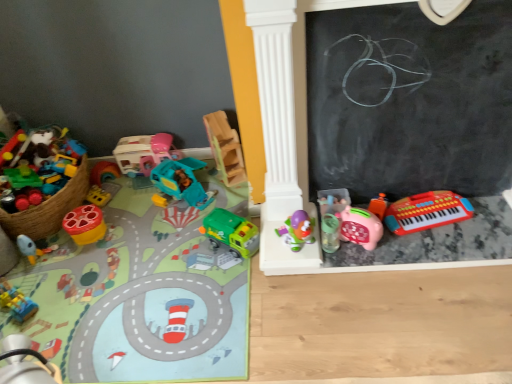
Locate an element on the screen. vacant area that lies to the right of matte plastic toy rocket at lower left, which is the 12th toy from right to left is located at coordinates (76, 258).